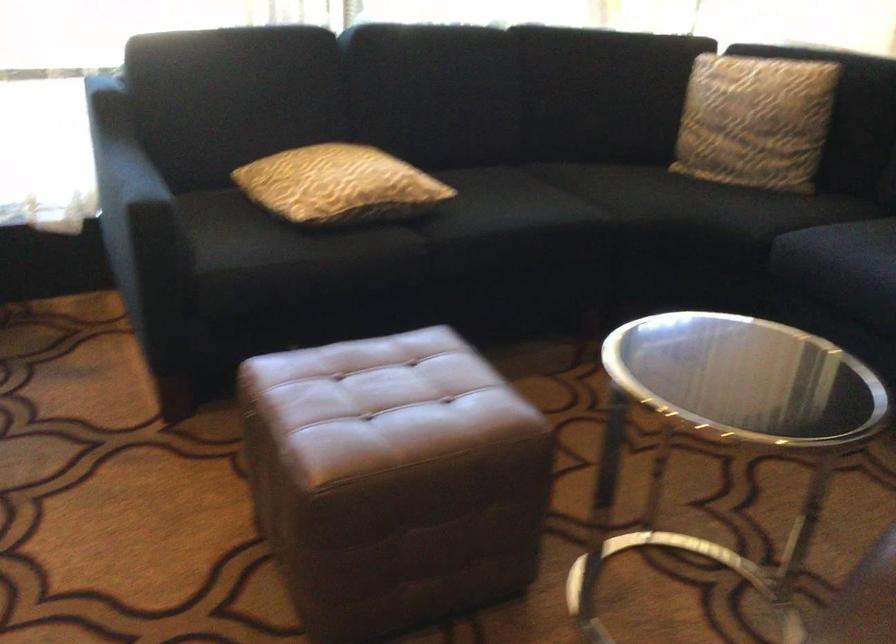
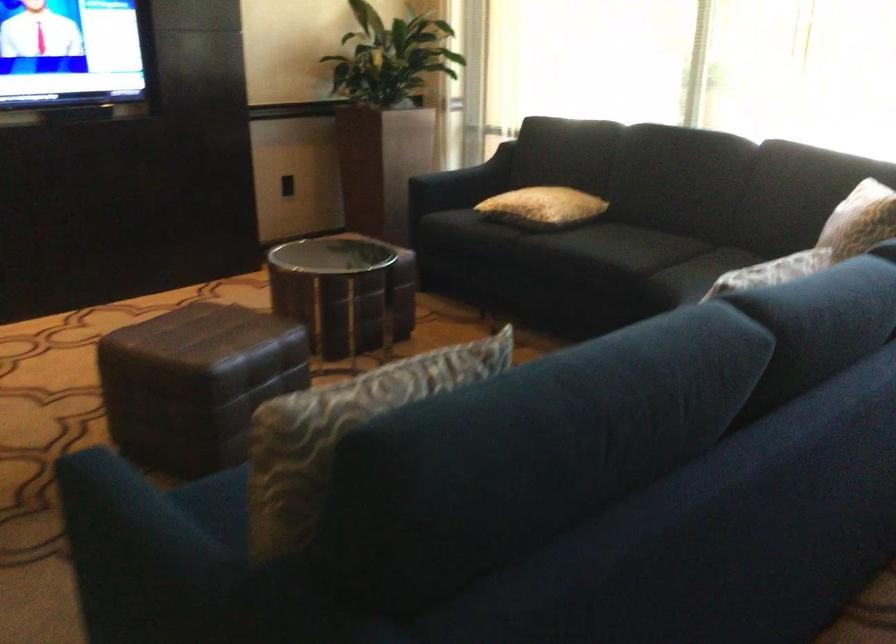
Locate, in the second image, the point that corresponds to the point at 824,88 in the first image.

(859, 220)